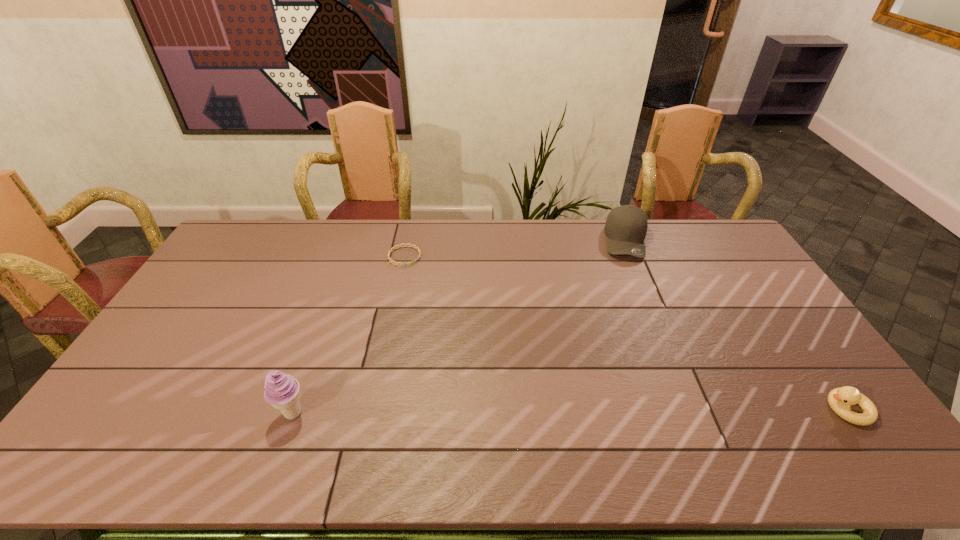
You are a GUI agent. You are given a task and a screenshot of the screen. Output one action in this format:
    pyautogui.click(x=<x>, y=<y>)
    Task: Click on the free spot that satisfies the following two spatial constraints: 1. on the front side of the duckling; 2. at the beak of the second object from right to left
    The height and width of the screenshot is (540, 960).
    Given the screenshot: What is the action you would take?
    pyautogui.click(x=697, y=409)

I want to click on free point that satisfies the following two spatial constraints: 1. on the back side of the third shortest object; 2. on the right side of the bracelet, so click(408, 240).

The width and height of the screenshot is (960, 540). I want to click on free space in the image that satisfies the following two spatial constraints: 1. on the back side of the third object from right to left; 2. on the right side of the icecream, so click(x=349, y=256).

Identify the location of vacant position in the image that satisfies the following two spatial constraints: 1. on the back side of the second object from left to right; 2. on the left side of the third shortest object. (408, 240).